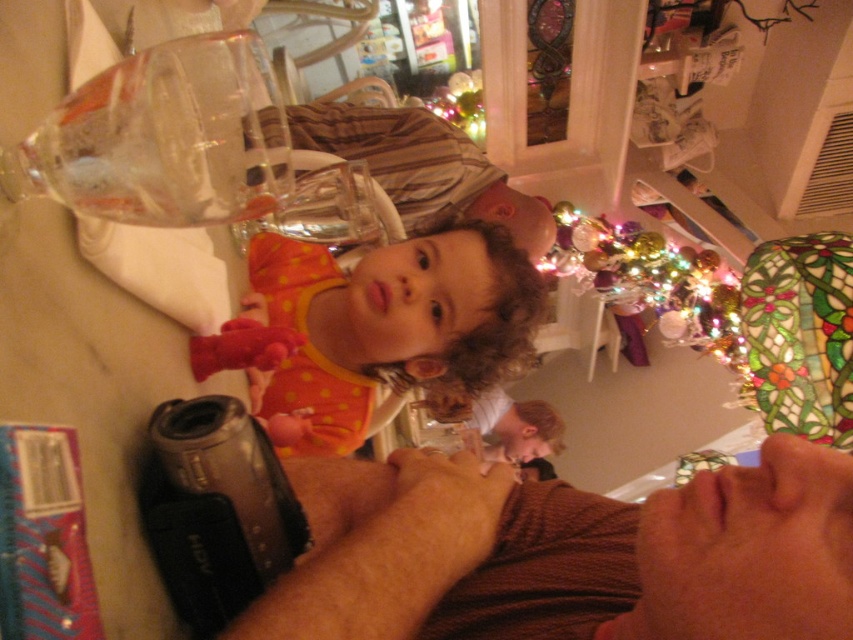
Question: Based on their relative distances, which object is nearer to the iridescent glass ornament at upper right?

Choices:
 (A) brown knit sweater at center
 (B) orange polka dot dress at center
 (C) striped cotton shirt at upper center

Answer: (C)

Question: Does brown knit sweater at center have a smaller size compared to iridescent glass ornament at upper right?

Choices:
 (A) yes
 (B) no

Answer: (A)

Question: Is striped cotton shirt at upper center to the left of iridescent glass ornament at upper right from the viewer's perspective?

Choices:
 (A) no
 (B) yes

Answer: (B)

Question: Which point is closer to the camera?

Choices:
 (A) striped cotton shirt at upper center
 (B) orange polka dot dress at center
 (C) brown knit sweater at center

Answer: (C)

Question: Is striped cotton shirt at upper center further to the viewer compared to iridescent glass ornament at upper right?

Choices:
 (A) yes
 (B) no

Answer: (B)

Question: Which object is farther from the camera taking this photo?

Choices:
 (A) orange polka dot dress at center
 (B) brown knit sweater at center
 (C) striped cotton shirt at upper center
 (D) iridescent glass ornament at upper right

Answer: (D)